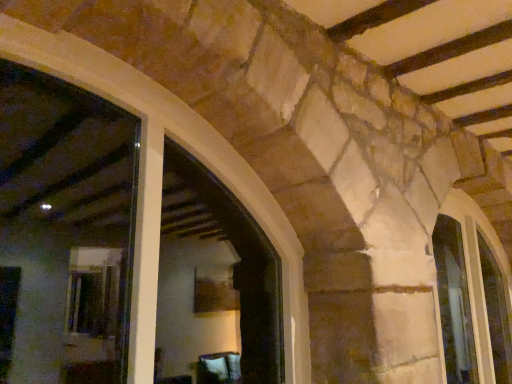
Question: Would you say clear glass window at center-right, the 2th window when ordered from right to left, is outside clear glass window at right, positioned as the 2th window in left-to-right order?

Choices:
 (A) no
 (B) yes

Answer: (B)

Question: From the image's perspective, is clear glass window at center-right, the 2th window when ordered from right to left, located above clear glass window at right, arranged as the first window when viewed from the right?

Choices:
 (A) yes
 (B) no

Answer: (A)

Question: Considering the relative sizes of clear glass window at center-right, the 1th window viewed from the left, and clear glass window at right, positioned as the 2th window in left-to-right order, in the image provided, is clear glass window at center-right, the 1th window viewed from the left, wider than clear glass window at right, positioned as the 2th window in left-to-right order,?

Choices:
 (A) yes
 (B) no

Answer: (B)

Question: Is clear glass window at right, positioned as the 2th window in left-to-right order, at the back of clear glass window at center-right, the 2th window when ordered from right to left?

Choices:
 (A) no
 (B) yes

Answer: (A)

Question: From a real-world perspective, does clear glass window at center-right, the 1th window viewed from the left, stand above clear glass window at right, positioned as the 2th window in left-to-right order?

Choices:
 (A) no
 (B) yes

Answer: (B)

Question: From the image's perspective, is clear glass window at center-right, the 1th window viewed from the left, under clear glass window at right, positioned as the 2th window in left-to-right order?

Choices:
 (A) no
 (B) yes

Answer: (A)

Question: Is clear glass window at right, positioned as the 2th window in left-to-right order, closer to camera compared to clear glass window at center-right, the 1th window viewed from the left?

Choices:
 (A) yes
 (B) no

Answer: (B)

Question: Is clear glass window at right, arranged as the first window when viewed from the right, placed right next to clear glass window at center-right, the 1th window viewed from the left?

Choices:
 (A) yes
 (B) no

Answer: (B)

Question: Can you confirm if clear glass window at right, arranged as the first window when viewed from the right, is thinner than clear glass window at center-right, the 1th window viewed from the left?

Choices:
 (A) no
 (B) yes

Answer: (A)

Question: Is clear glass window at right, positioned as the 2th window in left-to-right order, at the left side of clear glass window at center-right, the 2th window when ordered from right to left?

Choices:
 (A) yes
 (B) no

Answer: (B)

Question: Is clear glass window at right, positioned as the 2th window in left-to-right order, facing away from clear glass window at center-right, the 2th window when ordered from right to left?

Choices:
 (A) yes
 (B) no

Answer: (B)

Question: Does clear glass window at right, positioned as the 2th window in left-to-right order, have a smaller size compared to clear glass window at center-right, the 2th window when ordered from right to left?

Choices:
 (A) yes
 (B) no

Answer: (A)

Question: Considering the positions of clear glass window at right, positioned as the 2th window in left-to-right order, and clear glass window at center-right, the 2th window when ordered from right to left, in the image, is clear glass window at right, positioned as the 2th window in left-to-right order, bigger or smaller than clear glass window at center-right, the 2th window when ordered from right to left,?

Choices:
 (A) small
 (B) big

Answer: (A)